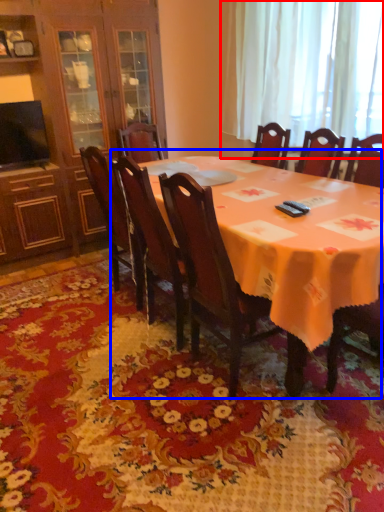
Question: Which object is further to the camera taking this photo, curtain (highlighted by a red box) or kitchen & dining room table (highlighted by a blue box)?

Choices:
 (A) curtain
 (B) kitchen & dining room table

Answer: (A)